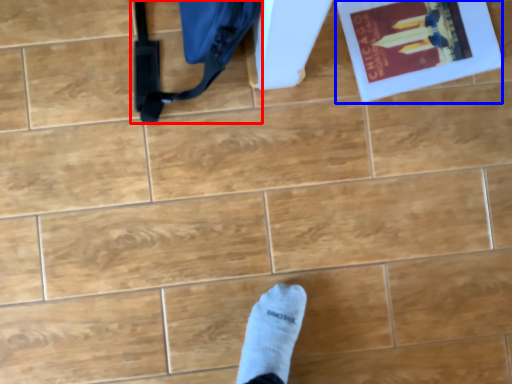
Question: Which of the following is the closest to the observer, messenger bag (highlighted by a red box) or paperback book (highlighted by a blue box)?

Choices:
 (A) messenger bag
 (B) paperback book

Answer: (A)